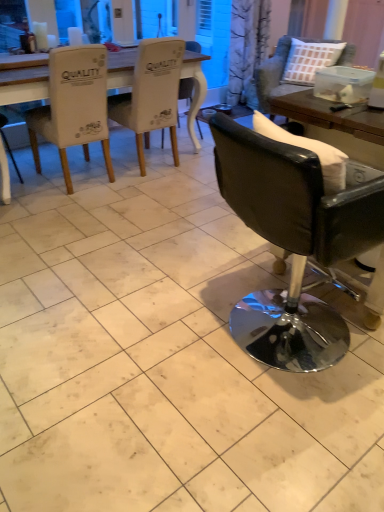
Question: Does white fabric chair at upper left, arranged as the 4th chair when viewed from the right, have a greater height compared to black leather chair at right, the 5th chair from the left?

Choices:
 (A) no
 (B) yes

Answer: (B)

Question: Are white fabric chair at upper left, arranged as the 4th chair when viewed from the right, and black leather chair at right, the 5th chair from the left, beside each other?

Choices:
 (A) no
 (B) yes

Answer: (A)

Question: From a real-world perspective, is white fabric chair at upper left, arranged as the 4th chair when viewed from the right, over black leather chair at right, which ranks as the 1th chair in right-to-left order?

Choices:
 (A) no
 (B) yes

Answer: (B)

Question: Is white fabric chair at upper left, which is counted as the second chair, starting from the left, completely or partially outside of black leather chair at right, which ranks as the 1th chair in right-to-left order?

Choices:
 (A) no
 (B) yes

Answer: (B)

Question: Does white fabric chair at upper left, which is counted as the second chair, starting from the left, have a larger size compared to black leather chair at right, the 5th chair from the left?

Choices:
 (A) yes
 (B) no

Answer: (B)

Question: Is black leather chair at right, which ranks as the 1th chair in right-to-left order, taller or shorter than black leather chair at right, the fourth chair when ordered from left to right?

Choices:
 (A) tall
 (B) short

Answer: (B)

Question: Considering the relative positions of black leather chair at right, which ranks as the 1th chair in right-to-left order, and black leather chair at right, acting as the 2th chair starting from the right, in the image provided, is black leather chair at right, which ranks as the 1th chair in right-to-left order, to the left or to the right of black leather chair at right, acting as the 2th chair starting from the right,?

Choices:
 (A) left
 (B) right

Answer: (B)

Question: Based on their sizes in the image, would you say black leather chair at right, the 5th chair from the left, is bigger or smaller than black leather chair at right, acting as the 2th chair starting from the right?

Choices:
 (A) big
 (B) small

Answer: (A)

Question: Relative to black leather chair at right, the fourth chair when ordered from left to right, is black leather chair at right, which ranks as the 1th chair in right-to-left order, in front or behind?

Choices:
 (A) front
 (B) behind

Answer: (B)

Question: Do you think white fabric chair at upper left, arranged as the 4th chair when viewed from the right, is within white fabric chair at center, which ranks as the 3th chair in right-to-left order, or outside of it?

Choices:
 (A) outside
 (B) inside

Answer: (A)

Question: Is white fabric chair at upper left, which is counted as the second chair, starting from the left, wider or thinner than white fabric chair at center, the third chair when ordered from left to right?

Choices:
 (A) thin
 (B) wide

Answer: (B)

Question: In the image, is white fabric chair at upper left, which is counted as the second chair, starting from the left, on the left side or the right side of white fabric chair at center, the third chair when ordered from left to right?

Choices:
 (A) left
 (B) right

Answer: (A)

Question: From the image's perspective, relative to white fabric chair at center, the third chair when ordered from left to right, is white fabric chair at upper left, arranged as the 4th chair when viewed from the right, above or below?

Choices:
 (A) below
 (B) above

Answer: (A)

Question: Considering the positions of point (145, 137) and point (107, 128), is point (145, 137) closer or farther from the camera than point (107, 128)?

Choices:
 (A) closer
 (B) farther

Answer: (B)

Question: Is white fabric chair at center, which ranks as the 3th chair in right-to-left order, bigger or smaller than white fabric chair at upper left, the fifth chair viewed from the right?

Choices:
 (A) big
 (B) small

Answer: (B)